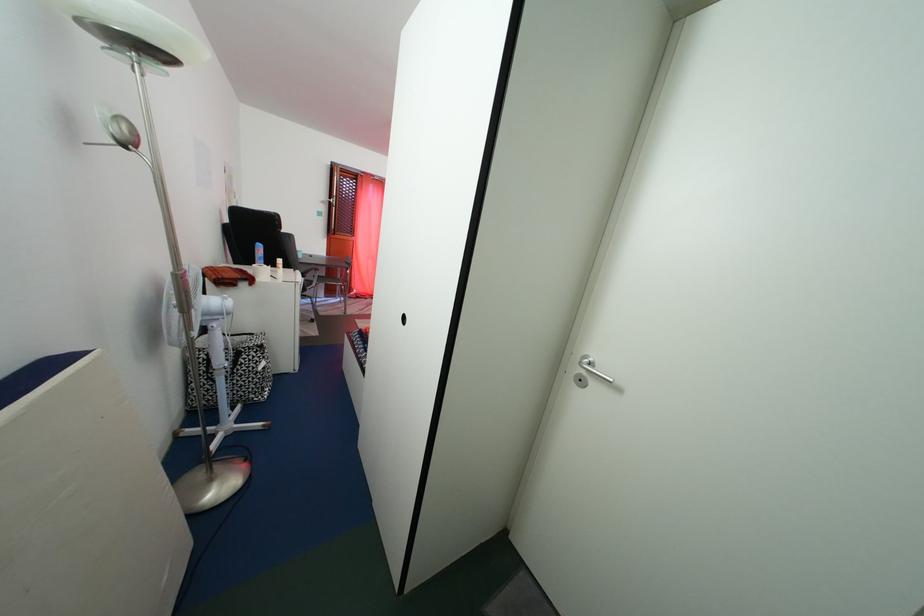
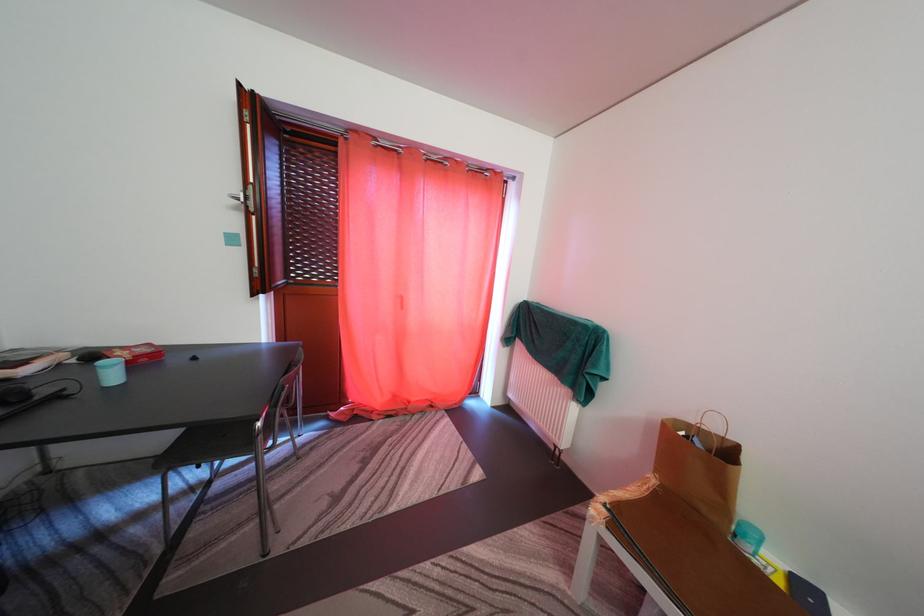
Question: Which direction would the cameraman need to move to produce the second image? Reply with the corresponding letter.

Choices:
 (A) Left
 (B) Right
 (C) Forward
 (D) Backward

Answer: (C)